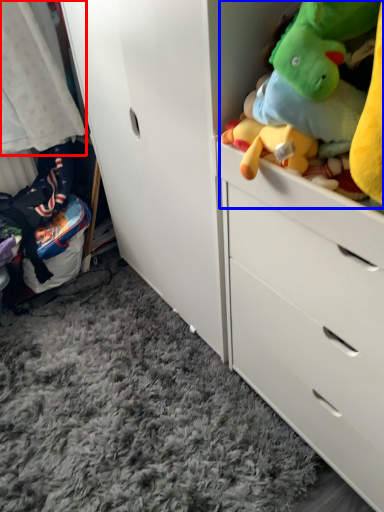
Question: Which object appears farthest to the camera in this image, baby clothe (highlighted by a red box) or stuff (highlighted by a blue box)?

Choices:
 (A) baby clothe
 (B) stuff

Answer: (A)